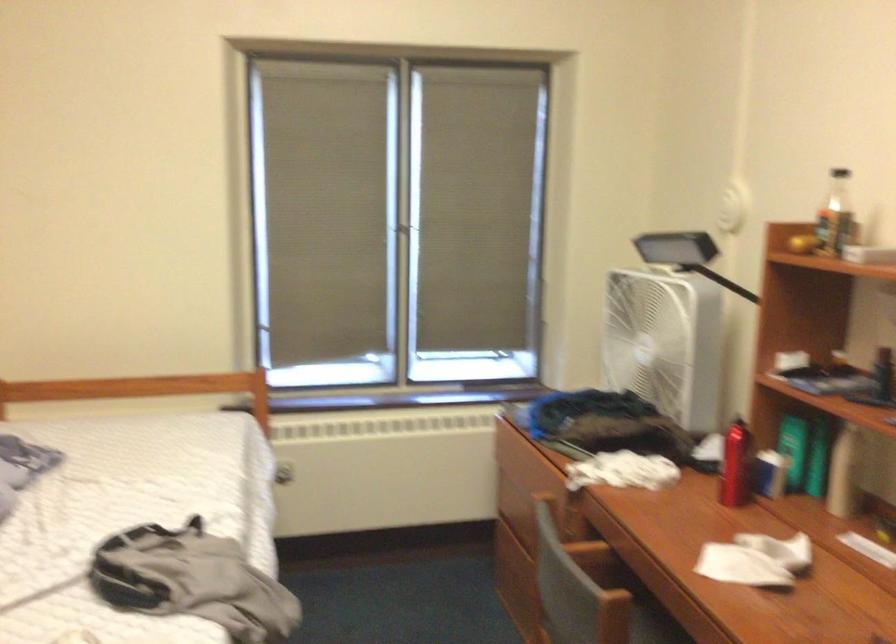
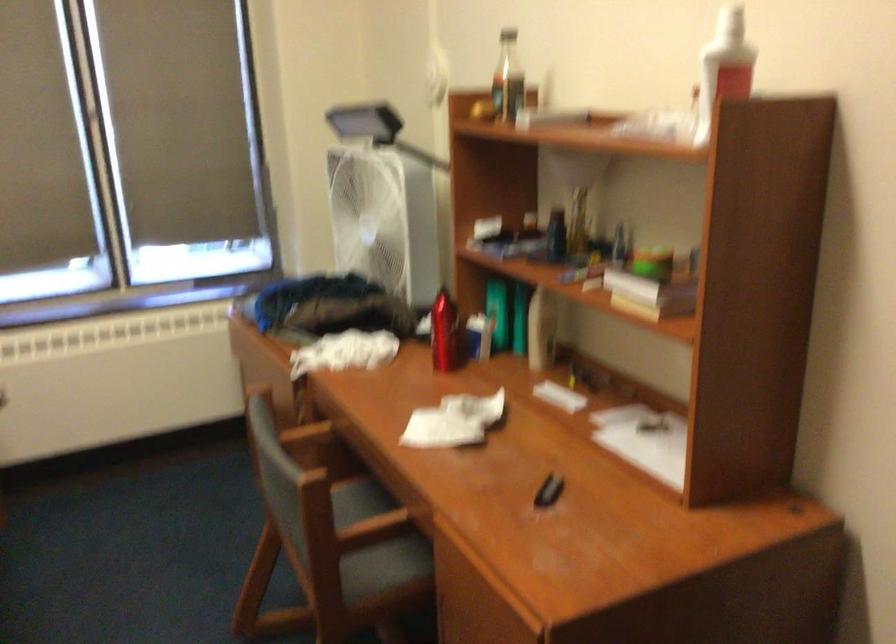
Question: What movement of the cameraman would produce the second image?

Choices:
 (A) Left
 (B) Right
 (C) Forward
 (D) Backward

Answer: (B)